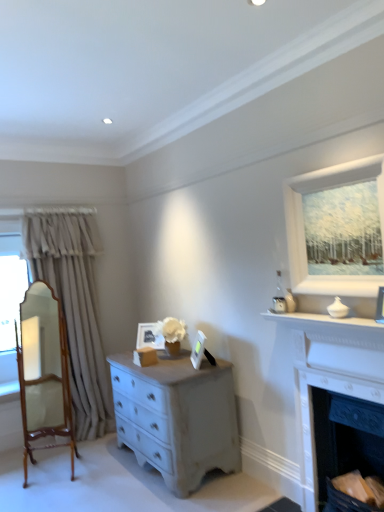
Measure the distance between point [34,395] and camera.

4.13 meters.

Where is `wooden polished mirror at left`? wooden polished mirror at left is located at coordinates (44, 372).

What is the approximate width of white glossy picture frame at center, which is the second picture frame from right to left?

white glossy picture frame at center, which is the second picture frame from right to left, is 4.55 inches wide.

In order to click on beige fabric curtain at left in this screenshot , I will do `click(74, 306)`.

What do you see at coordinates (304, 231) in the screenshot? I see `white painted wood at upper right` at bounding box center [304, 231].

Describe the element at coordinates (346, 444) in the screenshot. I see `dark gray stone fireplace at lower right, marked as the first fireplace in a bottom-to-top arrangement` at that location.

What are the coordinates of `wooden polished mirror at left` in the screenshot? It's located at (44, 372).

Is wooden polished mirror at left positioned with its back to white marble fireplace at right, which is counted as the first fireplace, starting from the top?

That's not correct — wooden polished mirror at left is not looking away from white marble fireplace at right, which is counted as the first fireplace, starting from the top.

Consider the image. Is wooden polished mirror at left bigger or smaller than white marble fireplace at right, which is counted as the first fireplace, starting from the top?

In the image, wooden polished mirror at left appears to be larger than white marble fireplace at right, which is counted as the first fireplace, starting from the top.

Does wooden polished mirror at left touch white marble fireplace at right, the 2th fireplace in the bottom-to-top sequence?

wooden polished mirror at left is not next to white marble fireplace at right, the 2th fireplace in the bottom-to-top sequence, and they're not touching.

Are white glossy picture frame at center, acting as the 2th picture frame starting from the left, and wooden polished mirror at left located far from each other?

Absolutely, white glossy picture frame at center, acting as the 2th picture frame starting from the left, is distant from wooden polished mirror at left.

Is white glossy picture frame at center, which appears as the 2th picture frame when viewed from the front, at the right side of wooden polished mirror at left?

Yes, white glossy picture frame at center, which appears as the 2th picture frame when viewed from the front, is to the right of wooden polished mirror at left.

In terms of height, does white glossy picture frame at center, the second picture frame when ordered from back to front, look taller or shorter compared to wooden polished mirror at left?

Considering their sizes, white glossy picture frame at center, the second picture frame when ordered from back to front, has less height than wooden polished mirror at left.

Does point (199, 366) come in front of point (56, 389)?

Yes, point (199, 366) is in front of point (56, 389).

Is there a large distance between beige fabric curtain at left and wooden polished mirror at left?

No, beige fabric curtain at left is in close proximity to wooden polished mirror at left.

Is beige fabric curtain at left wider or thinner than wooden polished mirror at left?

beige fabric curtain at left is wider than wooden polished mirror at left.

Considering the sizes of beige fabric curtain at left and wooden polished mirror at left in the image, is beige fabric curtain at left bigger or smaller than wooden polished mirror at left?

In the image, beige fabric curtain at left appears to be larger than wooden polished mirror at left.

From the image's perspective, which one is positioned lower, beige fabric curtain at left or wooden polished mirror at left?

From the image's view, wooden polished mirror at left is below.

Which point is more forward, (197,350) or (294,341)?

Point (294,341)

Is white glossy picture frame at center, which is the second picture frame from right to left, not within white marble fireplace at right, which is counted as the first fireplace, starting from the top?

Yes, white glossy picture frame at center, which is the second picture frame from right to left, is outside of white marble fireplace at right, which is counted as the first fireplace, starting from the top.

How distant is white glossy picture frame at center, which is the second picture frame from right to left, from white marble fireplace at right, the 2th fireplace in the bottom-to-top sequence?

They are 1.06 meters apart.

Would you say white glossy picture frame at center, the 2th picture frame in the bottom-to-top sequence, is to the left or to the right of white marble fireplace at right, which is counted as the first fireplace, starting from the top, in the picture?

In the image, white glossy picture frame at center, the 2th picture frame in the bottom-to-top sequence, appears on the left side of white marble fireplace at right, which is counted as the first fireplace, starting from the top.

From the image's perspective, is white painted wood at upper right below matte white picture frame at center, the third picture frame positioned from the front?

No, from the image's perspective, white painted wood at upper right is not beneath matte white picture frame at center, the third picture frame positioned from the front.

Is white painted wood at upper right far from matte white picture frame at center, the third picture frame positioned from the front?

Indeed, white painted wood at upper right is not near matte white picture frame at center, the third picture frame positioned from the front.

Between white painted wood at upper right and matte white picture frame at center, the 3th picture frame when ordered from top to bottom, which one has more height?

white painted wood at upper right.

From a real-world perspective, is white painted wood at upper right located higher than matte white picture frame at center, the third picture frame positioned from the front?

Yes, from a real-world perspective, white painted wood at upper right is over matte white picture frame at center, the third picture frame positioned from the front

In order to click on window frame that appears above the white matte picture frame at upper right, which is the third picture frame from back to front (from the image's perspective) in this screenshot , I will do `click(304, 231)`.

How many degrees apart are the facing directions of white painted wood at upper right and white matte picture frame at upper right, acting as the 3th picture frame starting from the left?

The angular difference between white painted wood at upper right and white matte picture frame at upper right, acting as the 3th picture frame starting from the left, is 8.36 degrees.

Which of these two, white painted wood at upper right or white matte picture frame at upper right, which is the third picture frame from bottom to top, stands shorter?

Standing shorter between the two is white matte picture frame at upper right, which is the third picture frame from bottom to top.

Would you say white painted wood at upper right contains white matte picture frame at upper right, which is counted as the 1th picture frame, starting from the right?

Actually, white matte picture frame at upper right, which is counted as the 1th picture frame, starting from the right, is outside white painted wood at upper right.

From a real-world perspective, is beige fabric curtain at left beneath white painted wood at upper right?

Yes.

Considering the relative sizes of beige fabric curtain at left and white painted wood at upper right in the image provided, is beige fabric curtain at left taller than white painted wood at upper right?

Yes.

Between beige fabric curtain at left and white painted wood at upper right, which one has larger width?

beige fabric curtain at left.

This screenshot has height=512, width=384. In order to click on armchair that appears above the white marble fireplace at right, which is counted as the first fireplace, starting from the top (from a real-world perspective) in this screenshot , I will do `click(44, 372)`.

The height and width of the screenshot is (512, 384). What are the coordinates of `armchair lying below the white glossy picture frame at center, the 2th picture frame in the bottom-to-top sequence (from the image's perspective)` in the screenshot? It's located at (44, 372).

Looking at the image, which one is located closer to wooden polished mirror at left, white matte picture frame at upper right, which is the third picture frame from back to front, or dark gray stone fireplace at lower right, marked as the first fireplace in a bottom-to-top arrangement?

Based on the image, dark gray stone fireplace at lower right, marked as the first fireplace in a bottom-to-top arrangement, appears to be nearer to wooden polished mirror at left.

In the scene shown: Considering their positions, is dark gray stone fireplace at lower right, the 2th fireplace when ordered from top to bottom, positioned further to white marble fireplace at right, which is counted as the first fireplace, starting from the top, than beige fabric curtain at left?

beige fabric curtain at left.

Looking at the image, which one is located closer to white marble fireplace at right, the 2th fireplace in the bottom-to-top sequence, white glossy picture frame at center, which is counted as the second picture frame, starting from the top, or matte white picture frame at center, acting as the first picture frame starting from the bottom?

Based on the image, white glossy picture frame at center, which is counted as the second picture frame, starting from the top, appears to be nearer to white marble fireplace at right, the 2th fireplace in the bottom-to-top sequence.

Which object lies further to the anchor point white painted wood at upper right, dark gray stone fireplace at lower right, marked as the first fireplace in a bottom-to-top arrangement, or beige fabric curtain at left?

beige fabric curtain at left lies further to white painted wood at upper right than the other object.

Estimate the real-world distances between objects in this image. Which object is further from white marble fireplace at right, the 2th fireplace in the bottom-to-top sequence, white glossy picture frame at center, which appears as the 2th picture frame when viewed from the front, or beige fabric curtain at left?

The object further to white marble fireplace at right, the 2th fireplace in the bottom-to-top sequence, is beige fabric curtain at left.

Estimate the real-world distances between objects in this image. Which object is further from beige fabric curtain at left, matte white picture frame at center, the third picture frame viewed from the right, or white matte picture frame at upper right, which is counted as the 1th picture frame, starting from the right?

white matte picture frame at upper right, which is counted as the 1th picture frame, starting from the right, is further to beige fabric curtain at left.

Considering their positions, is dark gray stone fireplace at lower right, the 2th fireplace when ordered from top to bottom, positioned closer to white matte picture frame at upper right, which is the 1th picture frame in top-to-bottom order, than white painted wood at upper right?

Among the two, white painted wood at upper right is located nearer to white matte picture frame at upper right, which is the 1th picture frame in top-to-bottom order.

Based on their spatial positions, is white painted wood at upper right or white marble fireplace at right, which is counted as the first fireplace, starting from the top, closer to beige fabric curtain at left?

white marble fireplace at right, which is counted as the first fireplace, starting from the top, lies closer to beige fabric curtain at left than the other object.

Where is `picture frame between wooden polished mirror at left and white glossy picture frame at center, which is counted as the second picture frame, starting from the top, from left to right`? The image size is (384, 512). picture frame between wooden polished mirror at left and white glossy picture frame at center, which is counted as the second picture frame, starting from the top, from left to right is located at coordinates (149, 337).

Find the location of a particular element. curtain between white matte picture frame at upper right, which is the third picture frame from bottom to top, and matte white picture frame at center, the first picture frame in the back-to-front sequence, in the front-back direction is located at coordinates (74, 306).

Locate an element on the screen. The height and width of the screenshot is (512, 384). picture frame between white painted wood at upper right and matte white picture frame at center, the first picture frame in the back-to-front sequence, along the z-axis is located at coordinates (198, 349).

In order to click on fireplace located between white marble fireplace at right, the 2th fireplace in the bottom-to-top sequence, and matte white picture frame at center, the third picture frame positioned from the front, in the depth direction in this screenshot , I will do click(x=346, y=444).